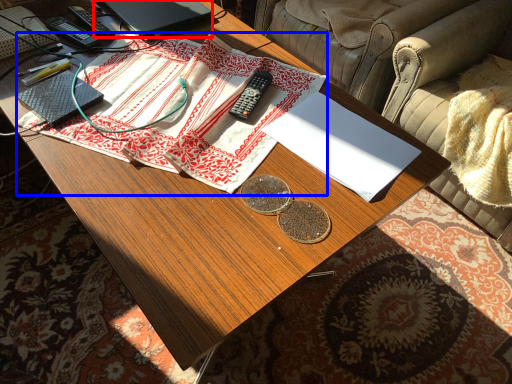
Question: Which object appears closest to the camera in this image, laptop (highlighted by a red box) or cloth (highlighted by a blue box)?

Choices:
 (A) laptop
 (B) cloth

Answer: (B)